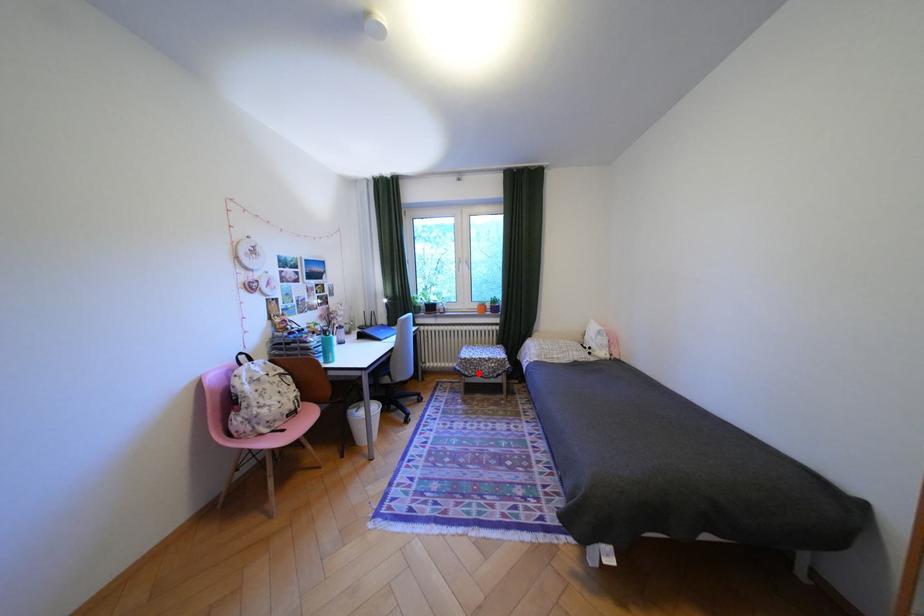
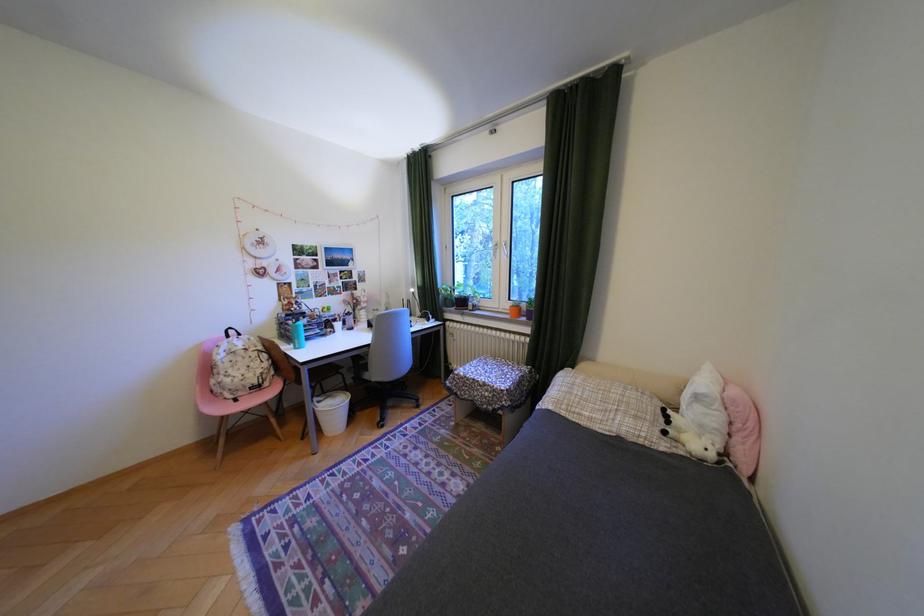
Locate, in the second image, the point that corresponds to the highlighted location in the first image.

(470, 392)